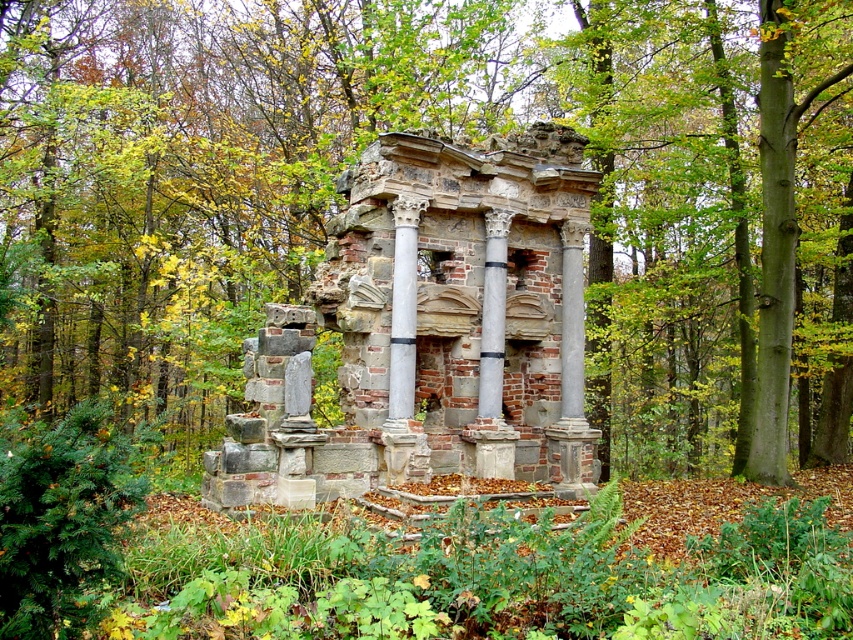
Can you confirm if white marble column at center is bigger than gray stone column at center?

Correct, white marble column at center is larger in size than gray stone column at center.

Does white marble column at center appear under gray stone column at center?

No.

Which is in front, point (412, 410) or point (498, 384)?

Point (412, 410) is more forward.

Identify the location of white marble column at center. pyautogui.click(x=403, y=307).

Does brick stone ruins at center appear on the left side of gray stone column at center?

Indeed, brick stone ruins at center is positioned on the left side of gray stone column at center.

Between brick stone ruins at center and gray stone column at center, which one has more height?

brick stone ruins at center is taller.

Between point (432, 397) and point (494, 355), which one is positioned behind?

The point (432, 397) is behind.

Where is `brick stone ruins at center`? brick stone ruins at center is located at coordinates (428, 330).

Does point (546, 337) lie in front of point (393, 241)?

No.

Can you confirm if brick stone ruins at center is wider than white marble column at center?

Correct, the width of brick stone ruins at center exceeds that of white marble column at center.

Where is `brick stone ruins at center`? brick stone ruins at center is located at coordinates (428, 330).

The height and width of the screenshot is (640, 853). I want to click on brick stone ruins at center, so click(428, 330).